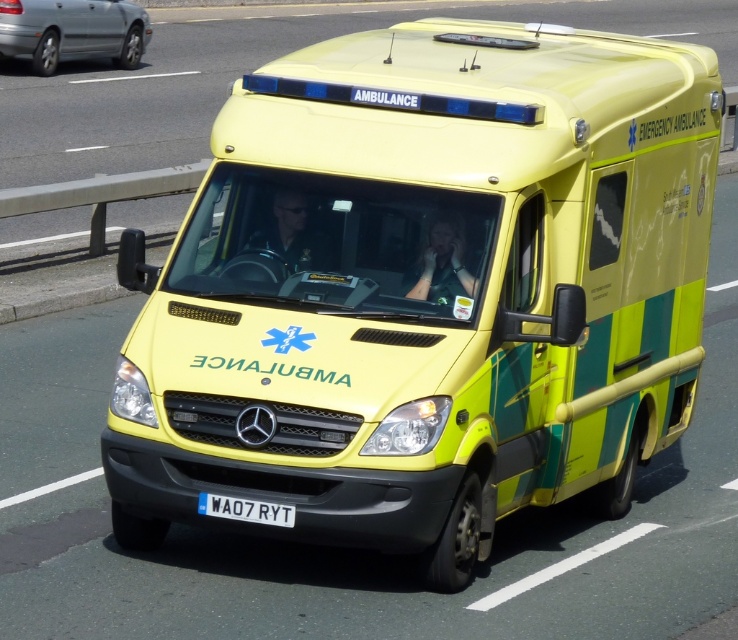
Question: Considering the real-world distances, which object is closest to the silver metallic sedan at upper left?

Choices:
 (A) yellow matte ambulance at center
 (B) white plastic license plate at center

Answer: (A)

Question: Which object is closer to the camera taking this photo?

Choices:
 (A) silver metallic sedan at upper left
 (B) yellow matte ambulance at center
 (C) white plastic license plate at center

Answer: (C)

Question: Observing the image, what is the correct spatial positioning of yellow matte ambulance at center in reference to silver metallic sedan at upper left?

Choices:
 (A) left
 (B) right

Answer: (B)

Question: Is yellow matte ambulance at center positioned at the back of white plastic license plate at center?

Choices:
 (A) no
 (B) yes

Answer: (B)

Question: Does yellow matte ambulance at center appear under white plastic license plate at center?

Choices:
 (A) no
 (B) yes

Answer: (A)

Question: Estimate the real-world distances between objects in this image. Which object is farther from the white plastic license plate at center?

Choices:
 (A) silver metallic sedan at upper left
 (B) yellow matte ambulance at center

Answer: (A)